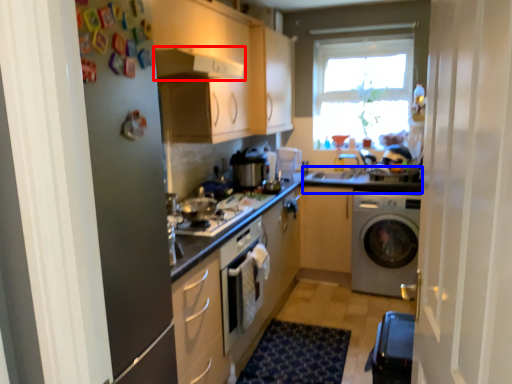
Question: Which point is closer to the camera, exhaust hood (highlighted by a red box) or counter top (highlighted by a blue box)?

Choices:
 (A) exhaust hood
 (B) counter top

Answer: (A)